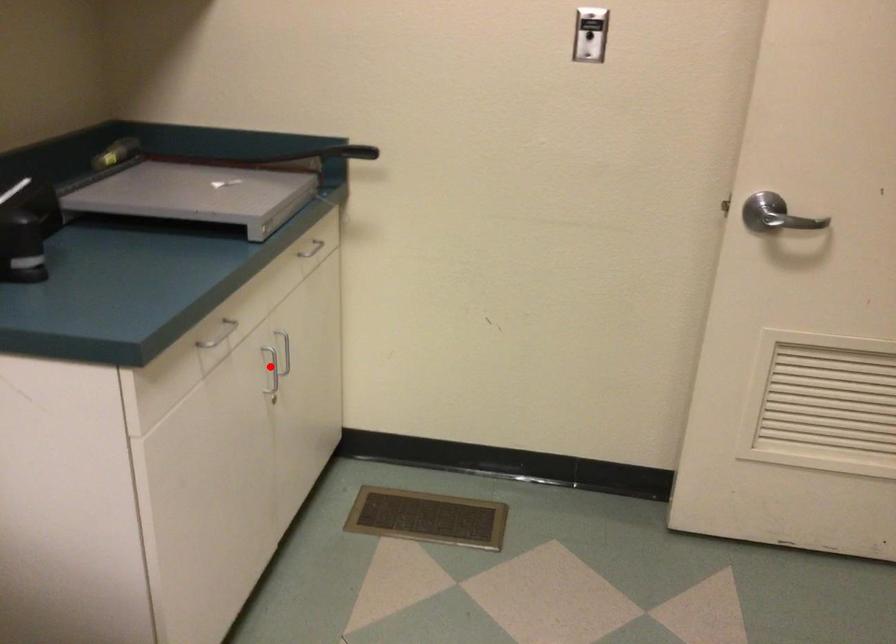
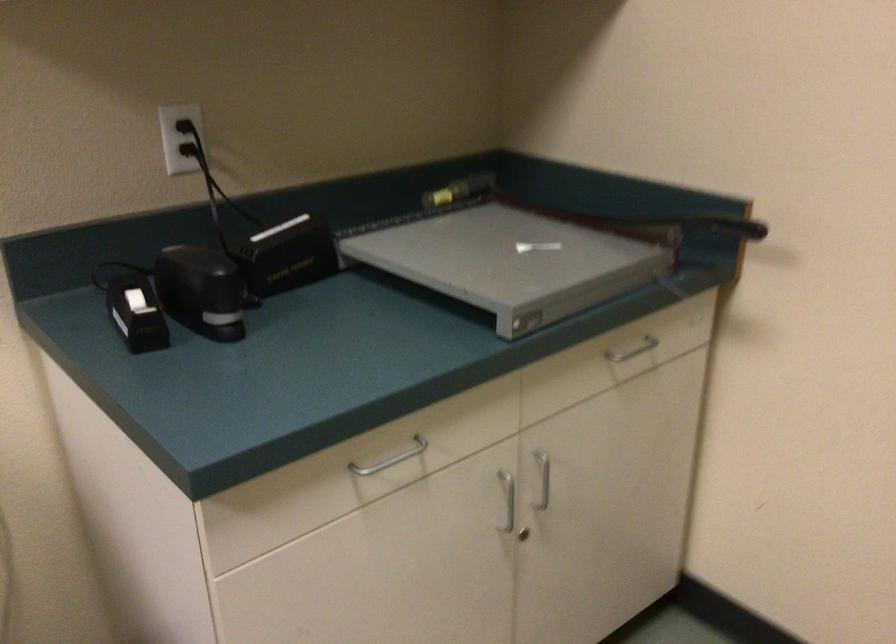
Question: I am providing you with two images of the same scene from different viewpoints. Image1 has a red point marked. In image2, the corresponding 3D location appears at what relative position? Reply with the corresponding letter.

Choices:
 (A) Closer
 (B) Farther

Answer: (A)